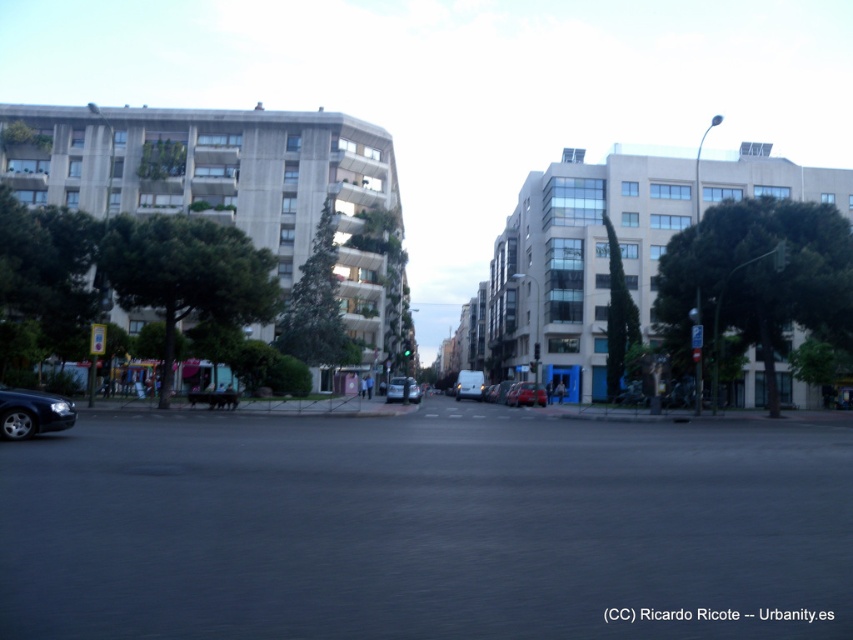
Question: Is shiny black sedan at lower left smaller than silver metallic van at center?

Choices:
 (A) yes
 (B) no

Answer: (A)

Question: Which of these objects is positioned closest to the shiny red car at center?

Choices:
 (A) shiny black sedan at lower left
 (B) silver metallic van at center

Answer: (B)

Question: Can you confirm if shiny red car at center is bigger than silver metallic van at center?

Choices:
 (A) no
 (B) yes

Answer: (A)

Question: Is shiny black sedan at lower left positioned before shiny red car at center?

Choices:
 (A) yes
 (B) no

Answer: (A)

Question: Which of the following is the closest to the observer?

Choices:
 (A) (3, 388)
 (B) (416, 388)

Answer: (A)

Question: Which object is positioned closest to the shiny red car at center?

Choices:
 (A) silver metallic van at center
 (B) shiny black sedan at lower left

Answer: (A)